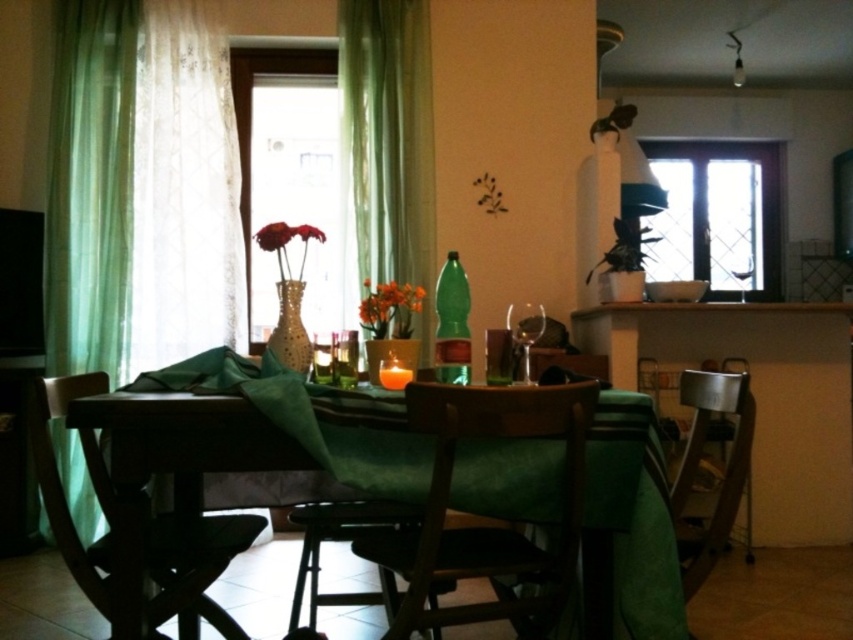
You are planning to set up a large dining set in the room. The wooden table at center and the transparent glass window at upper right are in the way. Which object should you move to make more space?

The wooden table at center should be moved because it has a smaller size compared to the transparent glass window at upper right, making it easier to relocate for creating more space.

You are standing at the edge of the dining table and want to pick up an item from the table. The two points you are considering are point 1 at coordinate (123, 8) and point 2 at coordinate (718, 188). Which point is closer to you?

Point 1 at coordinate (123, 8) is closer to you than point 2 at coordinate (718, 188).